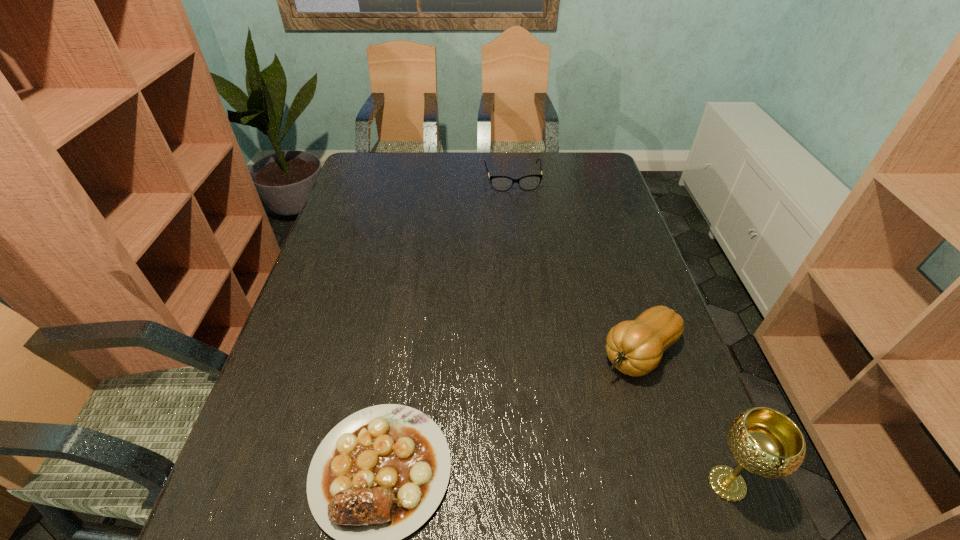
You are a GUI agent. You are given a task and a screenshot of the screen. Output one action in this format:
    pyautogui.click(x=<x>, y=<y>)
    Task: Click on the free space on the desktop that is between the steak and the tallest object and is positioned on the stem side of the gourd
    
    Given the screenshot: What is the action you would take?
    pyautogui.click(x=502, y=475)

The height and width of the screenshot is (540, 960). I want to click on free space on the desktop that is between the steak and the chalice and is positioned on the front-facing side of the third object from right to left, so click(x=574, y=478).